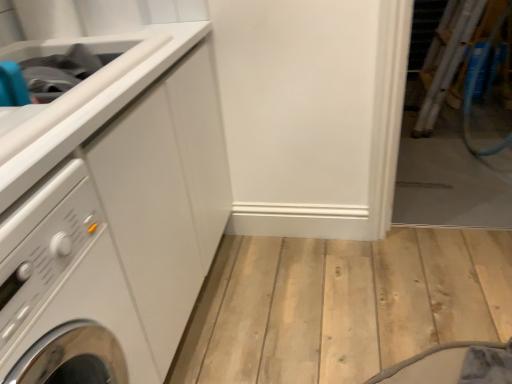
Question: From the image's perspective, is white glossy washing machine at left located beneath matte white sink at upper left?

Choices:
 (A) no
 (B) yes

Answer: (B)

Question: Would you say white glossy washing machine at left contains matte white sink at upper left?

Choices:
 (A) no
 (B) yes

Answer: (A)

Question: From a real-world perspective, is white glossy washing machine at left located beneath matte white sink at upper left?

Choices:
 (A) no
 (B) yes

Answer: (B)

Question: Does white glossy washing machine at left have a smaller size compared to matte white sink at upper left?

Choices:
 (A) yes
 (B) no

Answer: (B)

Question: Considering the relative sizes of white glossy washing machine at left and matte white sink at upper left in the image provided, is white glossy washing machine at left wider than matte white sink at upper left?

Choices:
 (A) yes
 (B) no

Answer: (A)

Question: Is the position of white glossy washing machine at left more distant than that of matte white sink at upper left?

Choices:
 (A) yes
 (B) no

Answer: (B)

Question: Does white glossy counter top at upper left have a larger size compared to white glossy washing machine at left?

Choices:
 (A) no
 (B) yes

Answer: (A)

Question: From the image's perspective, does white glossy counter top at upper left appear lower than white glossy washing machine at left?

Choices:
 (A) yes
 (B) no

Answer: (B)

Question: Can you confirm if white glossy counter top at upper left is thinner than white glossy washing machine at left?

Choices:
 (A) yes
 (B) no

Answer: (A)

Question: Is white glossy counter top at upper left facing towards white glossy washing machine at left?

Choices:
 (A) no
 (B) yes

Answer: (A)

Question: Is white glossy counter top at upper left outside of white glossy washing machine at left?

Choices:
 (A) yes
 (B) no

Answer: (A)

Question: Is white glossy counter top at upper left surrounding white glossy washing machine at left?

Choices:
 (A) no
 (B) yes

Answer: (A)

Question: Is white glossy washing machine at left beside white glossy counter top at upper left?

Choices:
 (A) no
 (B) yes

Answer: (A)